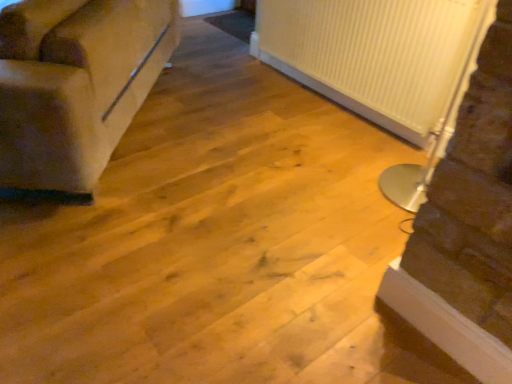
Question: From a real-world perspective, is suede-like beige couch at left on top of white ribbed radiator at right?

Choices:
 (A) no
 (B) yes

Answer: (A)

Question: Considering the relative sizes of suede-like beige couch at left and white ribbed radiator at right in the image provided, is suede-like beige couch at left wider than white ribbed radiator at right?

Choices:
 (A) yes
 (B) no

Answer: (A)

Question: Is suede-like beige couch at left oriented away from white ribbed radiator at right?

Choices:
 (A) no
 (B) yes

Answer: (B)

Question: Would you consider suede-like beige couch at left to be distant from white ribbed radiator at right?

Choices:
 (A) no
 (B) yes

Answer: (B)

Question: Is suede-like beige couch at left aimed at white ribbed radiator at right?

Choices:
 (A) yes
 (B) no

Answer: (B)

Question: Does suede-like beige couch at left have a greater height compared to white ribbed radiator at right?

Choices:
 (A) yes
 (B) no

Answer: (B)

Question: Considering the relative positions of white ribbed radiator at upper right and suede-like beige couch at left in the image provided, is white ribbed radiator at upper right in front of suede-like beige couch at left?

Choices:
 (A) no
 (B) yes

Answer: (A)

Question: From the image's perspective, would you say white ribbed radiator at upper right is shown under suede-like beige couch at left?

Choices:
 (A) no
 (B) yes

Answer: (A)

Question: From the image's perspective, does white ribbed radiator at upper right appear higher than suede-like beige couch at left?

Choices:
 (A) yes
 (B) no

Answer: (A)

Question: Is white ribbed radiator at upper right thinner than suede-like beige couch at left?

Choices:
 (A) no
 (B) yes

Answer: (B)

Question: Is white ribbed radiator at upper right at the right side of suede-like beige couch at left?

Choices:
 (A) yes
 (B) no

Answer: (A)

Question: Can you see white ribbed radiator at upper right touching suede-like beige couch at left?

Choices:
 (A) yes
 (B) no

Answer: (B)

Question: Does white ribbed radiator at right have a smaller size compared to white ribbed radiator at upper right?

Choices:
 (A) no
 (B) yes

Answer: (A)